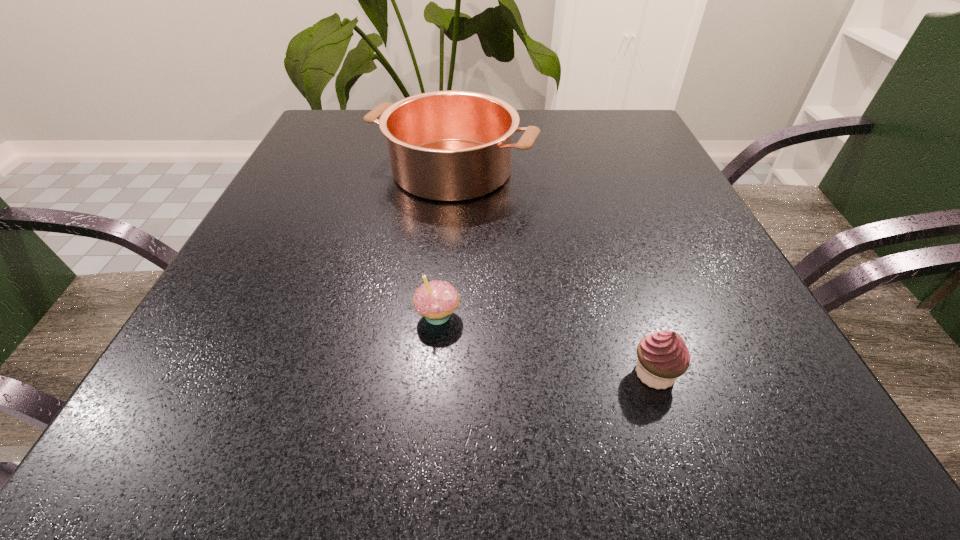
Locate an element on the screen. The image size is (960, 540). object that is at the right edge is located at coordinates (663, 356).

Where is `vacant space at the far edge of the desktop`? The image size is (960, 540). vacant space at the far edge of the desktop is located at coordinates (549, 111).

I want to click on vacant space at the left edge of the desktop, so click(242, 259).

The width and height of the screenshot is (960, 540). In the image, there is a desktop. What are the coordinates of `vacant space at the right edge` in the screenshot? It's located at (609, 155).

I want to click on free space at the far left corner of the desktop, so click(330, 119).

Identify the location of blank space at the near left corner of the desktop. This screenshot has width=960, height=540. (234, 432).

Find the location of a particular element. vacant space at the far right corner of the desktop is located at coordinates (601, 119).

In the image, there is a desktop. Where is `free space at the near right corner`? This screenshot has width=960, height=540. free space at the near right corner is located at coordinates (820, 449).

At what (x,y) coordinates should I click in order to perform the action: click on free space between the farthest object and the left cupcake. Please return your answer as a coordinate pair (x, y). Image resolution: width=960 pixels, height=540 pixels. Looking at the image, I should click on (444, 242).

In order to click on free area in between the nearest object and the farthest object in this screenshot , I will do `click(553, 272)`.